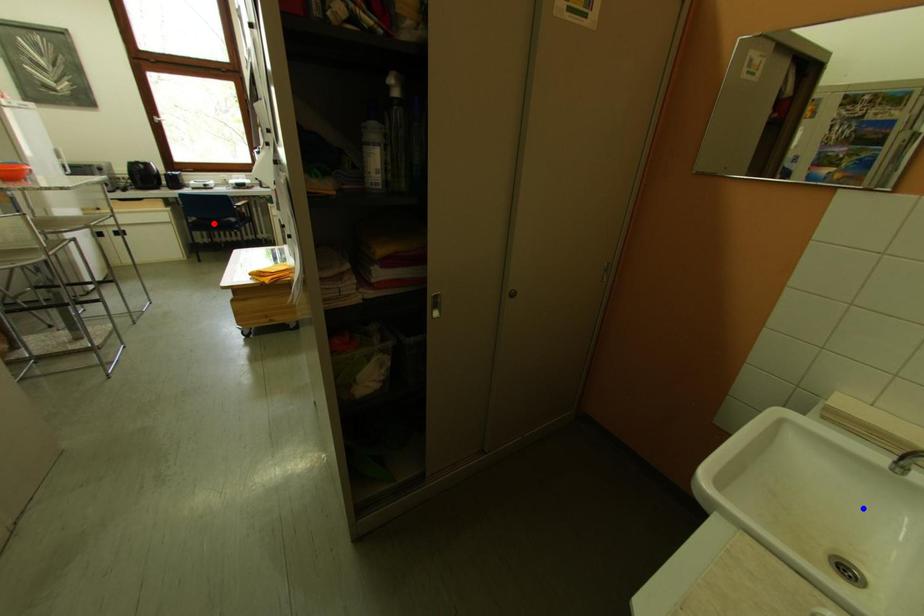
Question: In the image, two points are highlighted. Which point is nearer to the camera? Reply with the corresponding letter.

Choices:
 (A) blue point
 (B) red point

Answer: (A)